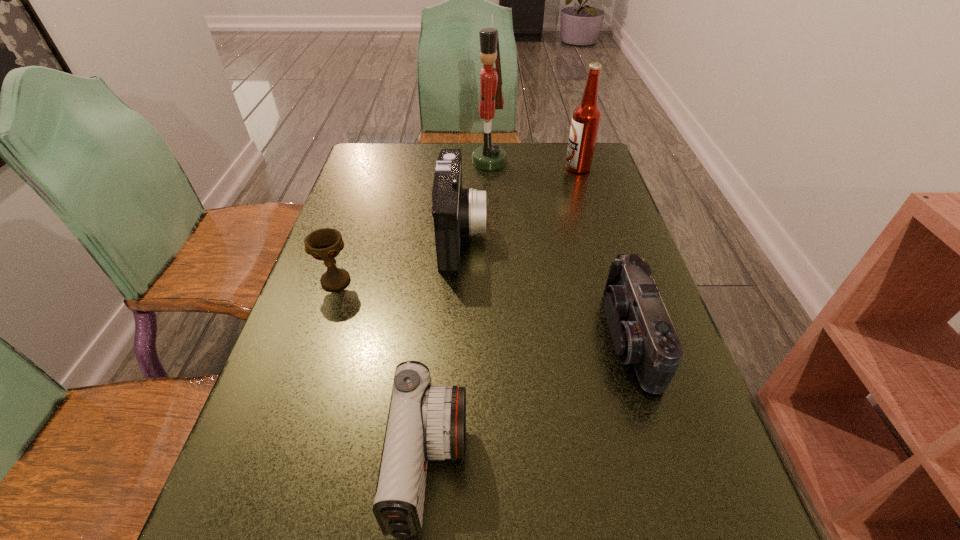
Locate an element on the screen. alcohol located at the right edge is located at coordinates pos(586,118).

Find the location of a particular element. camcorder at the right edge is located at coordinates (642, 333).

Where is `object located in the far right corner section of the desktop`? The width and height of the screenshot is (960, 540). object located in the far right corner section of the desktop is located at coordinates (586, 118).

The height and width of the screenshot is (540, 960). I want to click on vacant area at the far edge of the desktop, so click(x=469, y=179).

Locate an element on the screen. Image resolution: width=960 pixels, height=540 pixels. blank space at the left edge is located at coordinates (351, 309).

The image size is (960, 540). Find the location of `free space at the right edge of the desktop`. free space at the right edge of the desktop is located at coordinates (588, 293).

In order to click on vacant area at the far left corner of the desktop in this screenshot , I will do 374,153.

Find the location of a particular element. Image resolution: width=960 pixels, height=540 pixels. free space at the far right corner of the desktop is located at coordinates (567, 175).

Locate an element on the screen. empty location between the second farthest camcorder and the alcohol is located at coordinates (604, 252).

This screenshot has width=960, height=540. What are the coordinates of `vacant space that's between the rightmost camcorder and the second tallest object` in the screenshot? It's located at (604, 252).